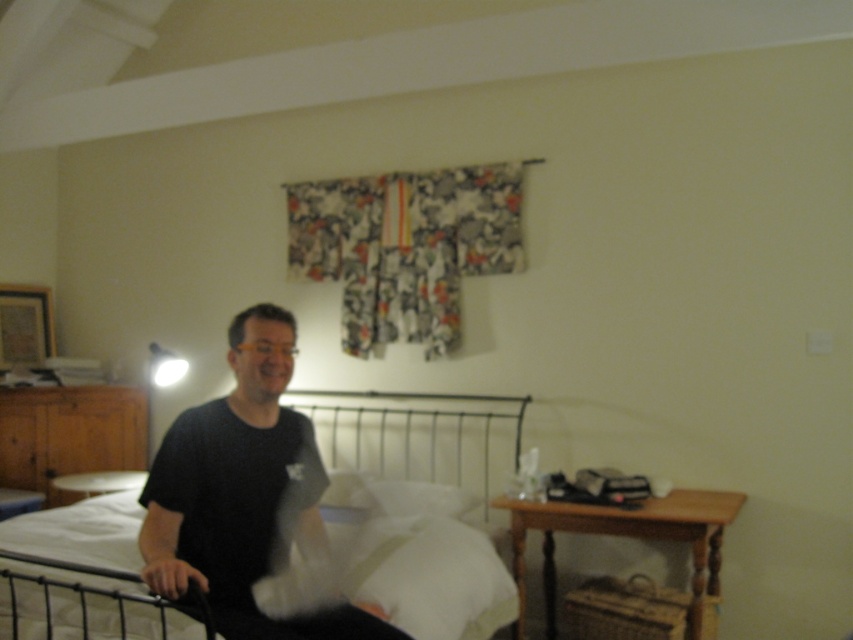
You are standing in the bedroom and want to place a small decorative item exactly at the point marked as point [164,472]. If the item is 2 feet tall, will it be visible from where you are standing?

The distance of point [164,472] from viewer is 6.20 feet, so yes, the 2 feet tall item placed there will be visible from your current position since its height is sufficient to be seen at that distance.

You are standing at the entrance of the bedroom and see two points marked in the room. The first point is at coordinate point (308, 522) and the second is at point (437, 570). Which point is closer to you?

Point (308, 522) is in front of point (437, 570), so it is closer to you.